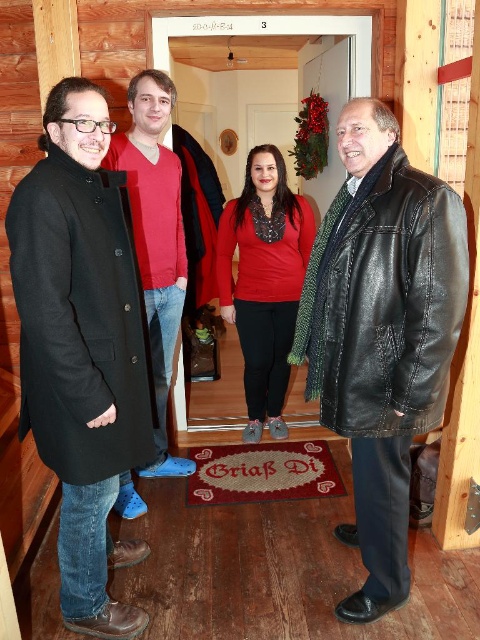
You are standing in the cabin and want to hand a gift to the person wearing the matte black coat at left and the black leather coat at right. Which coat is closer to you so you can reach it first?

The matte black coat at left is closer to the viewer than the black leather coat at right, so you can reach it first.

You are standing in the cabin and want to place a small potted plant exactly at point (x=308, y=246). The plant requires a spot that is at least 10 feet away from you to ensure it gets enough sunlight. Is the chosen point far enough?

The distance of point (x=308, y=246) from viewer is 9.80 feet, which is less than the required 10 feet. Therefore, the spot is not far enough for the plant to get sufficient sunlight.